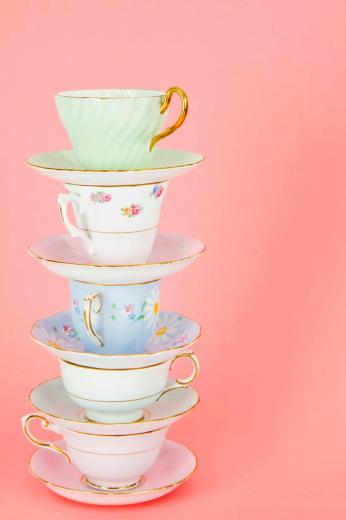
You are a GUI agent. You are given a task and a screenshot of the screen. Output one action in this format:
    pyautogui.click(x=<x>, y=<y>)
    Task: Click on the teacup
    This screenshot has width=346, height=520.
    Given the screenshot: What is the action you would take?
    pyautogui.click(x=123, y=447), pyautogui.click(x=112, y=390), pyautogui.click(x=118, y=310), pyautogui.click(x=118, y=215), pyautogui.click(x=120, y=132)